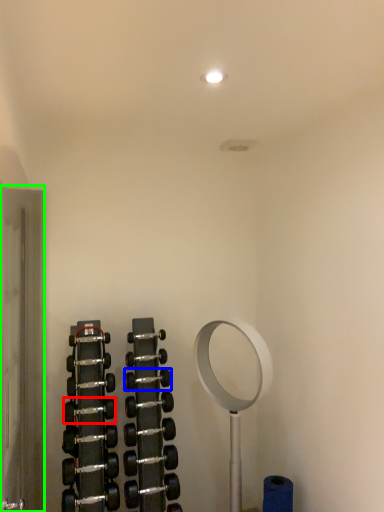
Question: Which is nearer to the dumbbell (highlighted by a red box)? dumbbell (highlighted by a blue box) or glass door (highlighted by a green box).

Choices:
 (A) dumbbell
 (B) glass door

Answer: (A)